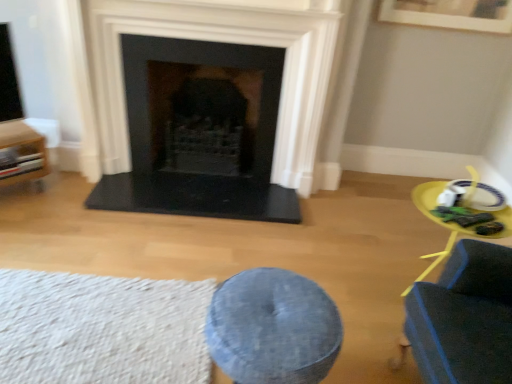
Question: From a real-world perspective, is black stone fireplace at center on wooden cabinet at left?

Choices:
 (A) yes
 (B) no

Answer: (A)

Question: Considering the relative sizes of black stone fireplace at center and wooden cabinet at left in the image provided, is black stone fireplace at center wider than wooden cabinet at left?

Choices:
 (A) no
 (B) yes

Answer: (A)

Question: Is black stone fireplace at center placed right next to wooden cabinet at left?

Choices:
 (A) no
 (B) yes

Answer: (A)

Question: Is black stone fireplace at center to the right of wooden cabinet at left from the viewer's perspective?

Choices:
 (A) yes
 (B) no

Answer: (A)

Question: Is black stone fireplace at center not near wooden cabinet at left?

Choices:
 (A) yes
 (B) no

Answer: (B)

Question: Looking at the image, does denim cushion at center seem bigger or smaller compared to black stone fireplace at center?

Choices:
 (A) big
 (B) small

Answer: (B)

Question: From a real-world perspective, is denim cushion at center positioned above or below black stone fireplace at center?

Choices:
 (A) above
 (B) below

Answer: (B)

Question: Considering the positions of point (270, 281) and point (124, 201), is point (270, 281) closer or farther from the camera than point (124, 201)?

Choices:
 (A) closer
 (B) farther

Answer: (A)

Question: Considering their positions, is denim cushion at center located in front of or behind black stone fireplace at center?

Choices:
 (A) behind
 (B) front

Answer: (B)

Question: Considering the positions of black stone fireplace at center and yellow plastic table at right in the image, is black stone fireplace at center wider or thinner than yellow plastic table at right?

Choices:
 (A) wide
 (B) thin

Answer: (B)

Question: In the image, is black stone fireplace at center positioned in front of or behind yellow plastic table at right?

Choices:
 (A) behind
 (B) front

Answer: (A)

Question: From a real-world perspective, is black stone fireplace at center above or below yellow plastic table at right?

Choices:
 (A) above
 (B) below

Answer: (A)

Question: From their relative heights in the image, would you say black stone fireplace at center is taller or shorter than yellow plastic table at right?

Choices:
 (A) short
 (B) tall

Answer: (B)

Question: From a real-world perspective, is black stone fireplace at center above or below white textured rug at lower left?

Choices:
 (A) above
 (B) below

Answer: (A)

Question: From the image's perspective, is black stone fireplace at center positioned above or below white textured rug at lower left?

Choices:
 (A) above
 (B) below

Answer: (A)